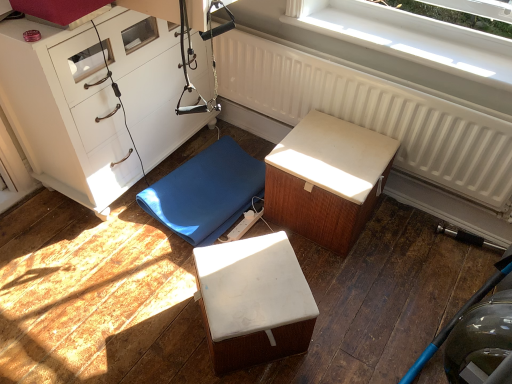
Where is `free space above white textured cushion at center, which is the third furniture from left to right (from a real-world perspective)`? This screenshot has width=512, height=384. free space above white textured cushion at center, which is the third furniture from left to right (from a real-world perspective) is located at coordinates (337, 152).